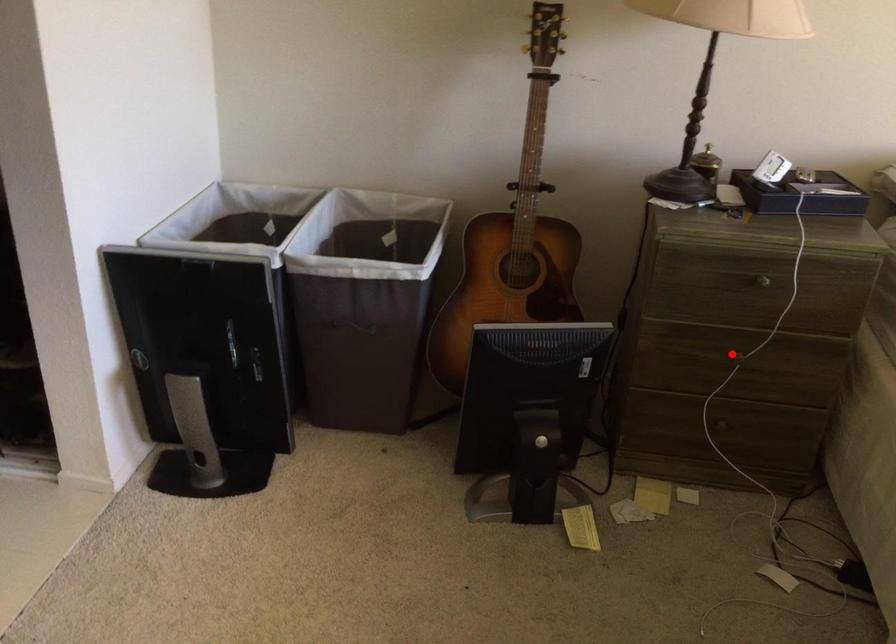
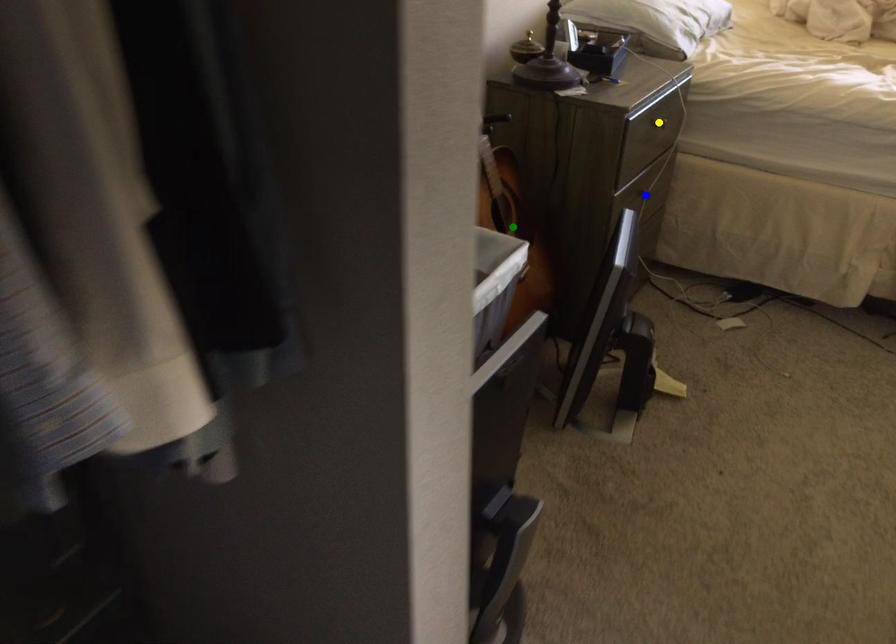
Question: I am providing you with two images of the same scene from different viewpoints. A red point is marked on the first image. You are given multiple points on the second image. Can you choose the point in image 2 that corresponds to the point in image 1?

Choices:
 (A) blue point
 (B) yellow point
 (C) green point

Answer: (A)